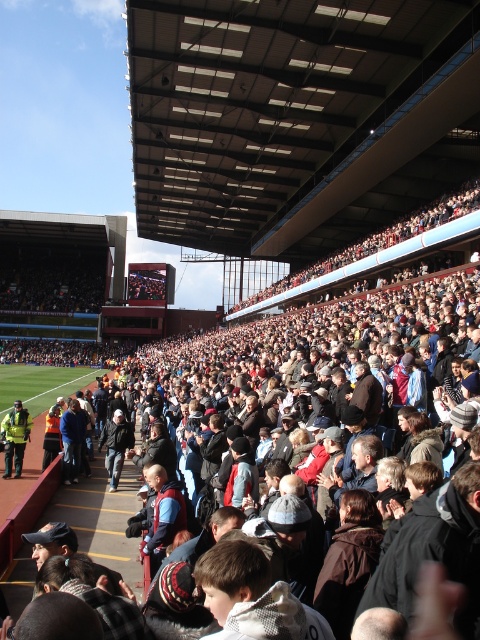
Between dark brown leather jacket at center and yellow reflective jacket at lower left, which one is positioned lower?

Positioned lower is yellow reflective jacket at lower left.

Consider the image. Who is positioned more to the left, dark brown leather jacket at center or yellow reflective jacket at lower left?

Positioned to the left is yellow reflective jacket at lower left.

This screenshot has width=480, height=640. What do you see at coordinates (322, 360) in the screenshot?
I see `dark brown leather jacket at center` at bounding box center [322, 360].

Locate an element on the screen. The image size is (480, 640). dark brown leather jacket at center is located at coordinates (322, 360).